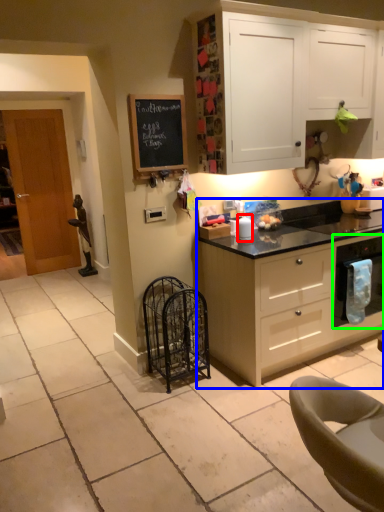
Question: Which object is positioned closest to appliance (highlighted by a red box)? Select from cabinetry (highlighted by a blue box) and kitchen appliance (highlighted by a green box).

Choices:
 (A) cabinetry
 (B) kitchen appliance

Answer: (A)